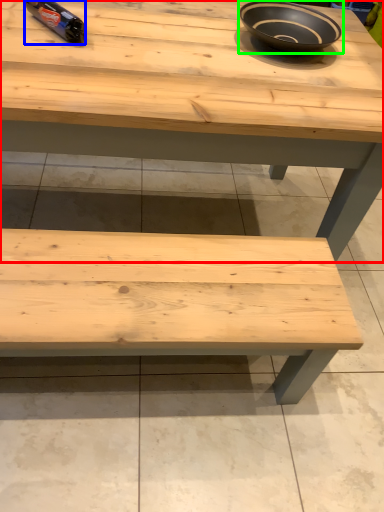
Question: Considering the real-world distances, which object is farthest from table (highlighted by a red box)? bottle (highlighted by a blue box) or bowl (highlighted by a green box)?

Choices:
 (A) bottle
 (B) bowl

Answer: (A)